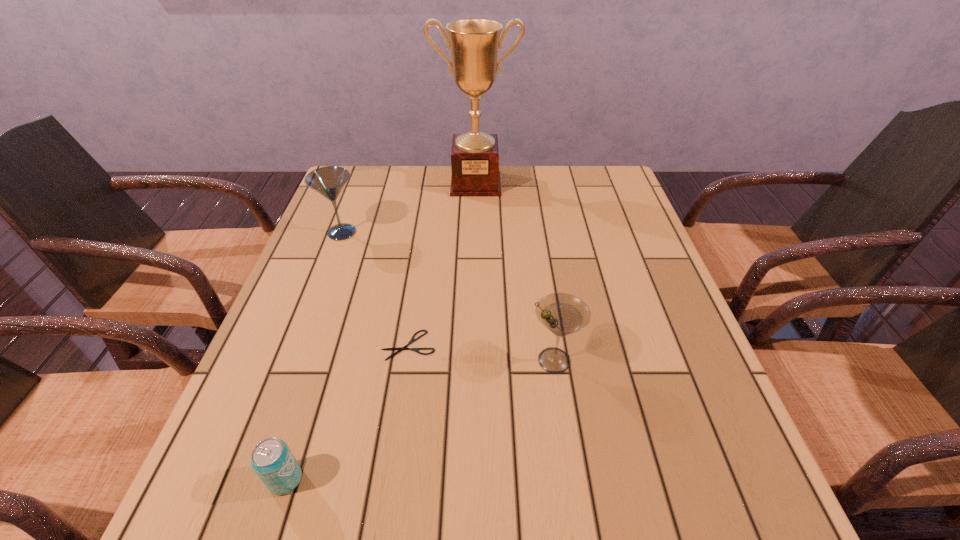
This screenshot has width=960, height=540. Find the location of `blank region between the fourth tallest object and the shears`. blank region between the fourth tallest object and the shears is located at coordinates (347, 412).

The image size is (960, 540). I want to click on free spot between the fourth nearest object and the nearest object, so click(314, 356).

This screenshot has width=960, height=540. What are the coordinates of `vacant area that lies between the fourth nearest object and the trophy cup` in the screenshot? It's located at coord(409,208).

Locate an element on the screen. blank region between the farthest object and the shears is located at coordinates (442, 264).

The image size is (960, 540). In order to click on the fourth closest object to the tallest object in this screenshot , I will do click(x=272, y=460).

At what (x,y) coordinates should I click in order to perform the action: click on object that is the fourth closest to the second farthest object. Please return your answer as a coordinate pair (x, y). This screenshot has width=960, height=540. Looking at the image, I should click on (272, 460).

Find the location of a particular element. Image resolution: width=960 pixels, height=540 pixels. vacant region that satisfies the following two spatial constraints: 1. on the plaque of the trophy cup; 2. on the right side of the right martini is located at coordinates (473, 360).